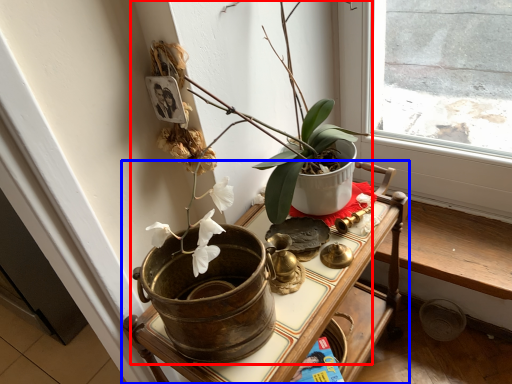
Question: Which of the following is the farthest to the observer, houseplant (highlighted by a red box) or table (highlighted by a blue box)?

Choices:
 (A) houseplant
 (B) table

Answer: (B)